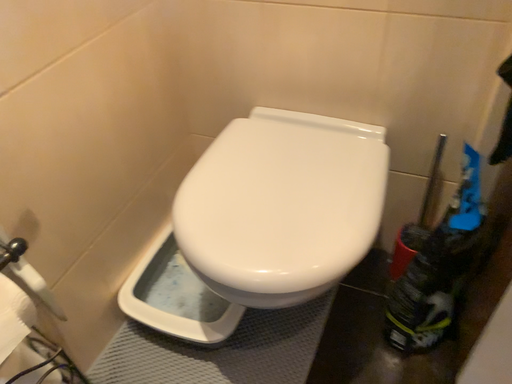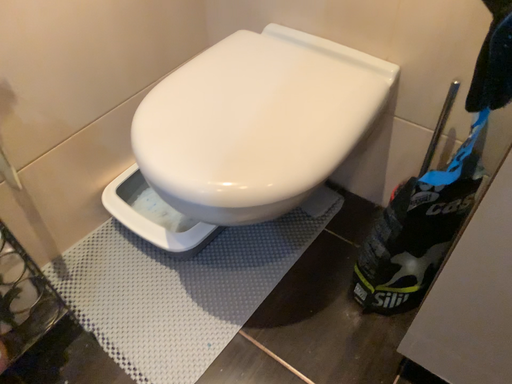
Question: How did the camera likely rotate when shooting the video?

Choices:
 (A) rotated right
 (B) rotated left

Answer: (B)